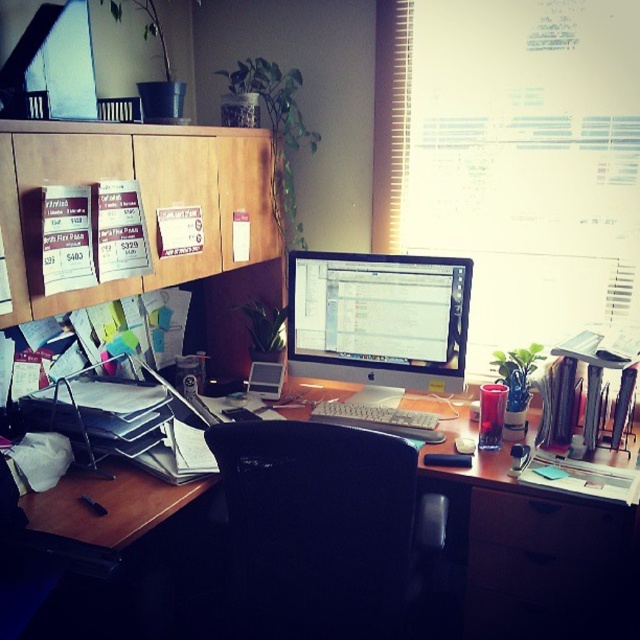
Consider the image. You are organizing a home office and need to place two decorative items on the desk. You have two points marked on the desk surface at coordinates point (372, 292) and point (476, 522). Which point is closer to you when standing in front of the desk?

Point (372, 292) is closer to you because it is further to the viewer than point (476, 522), meaning it is positioned nearer to your standing position in front of the desk.

You are organizing your desk and want to place a new wireless keyboard that measures 18 inches in length between the satin black monitor at center and the black plastic drawer at lower right. Can the keyboard fit in the space between them without overlapping?

The distance between the satin black monitor at center and the black plastic drawer at lower right is 22.48 inches. Since the keyboard is 18 inches long, it will fit with some space to spare.